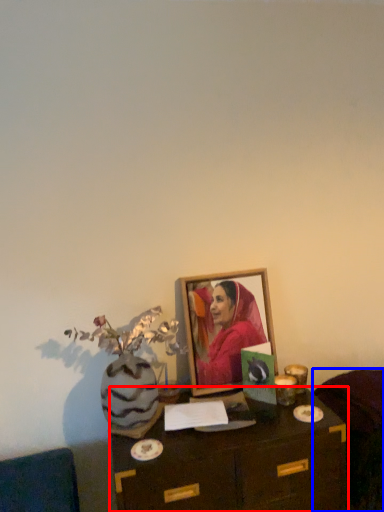
Question: Among these objects, which one is nearest to the camera, table (highlighted by a red box) or furniture (highlighted by a blue box)?

Choices:
 (A) table
 (B) furniture

Answer: (A)